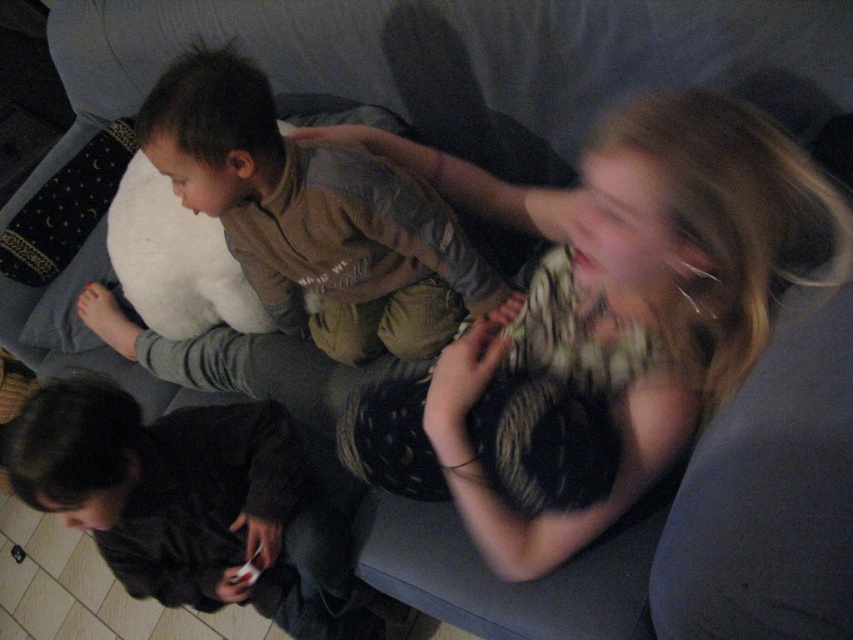
Identify the location of brown cotton shirt at upper left. This screenshot has height=640, width=853. (316, 218).

Can you confirm if brown cotton shirt at upper left is positioned to the left of white matte game controller at lower left?

No, brown cotton shirt at upper left is not to the left of white matte game controller at lower left.

You are a GUI agent. You are given a task and a screenshot of the screen. Output one action in this format:
    pyautogui.click(x=<x>, y=<y>)
    Task: Click on the brown cotton shirt at upper left
    
    Given the screenshot: What is the action you would take?
    pyautogui.click(x=316, y=218)